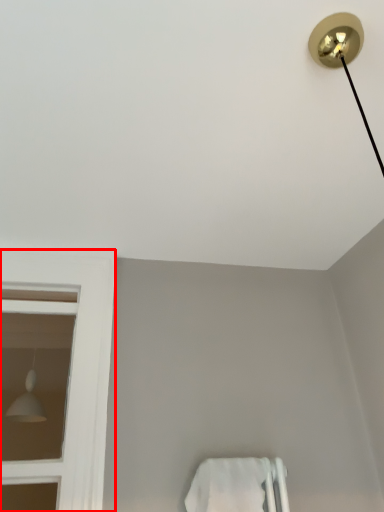
Question: From the image, what is the correct spatial relationship of bay window (annotated by the red box) in relation to towel bar?

Choices:
 (A) right
 (B) left

Answer: (B)